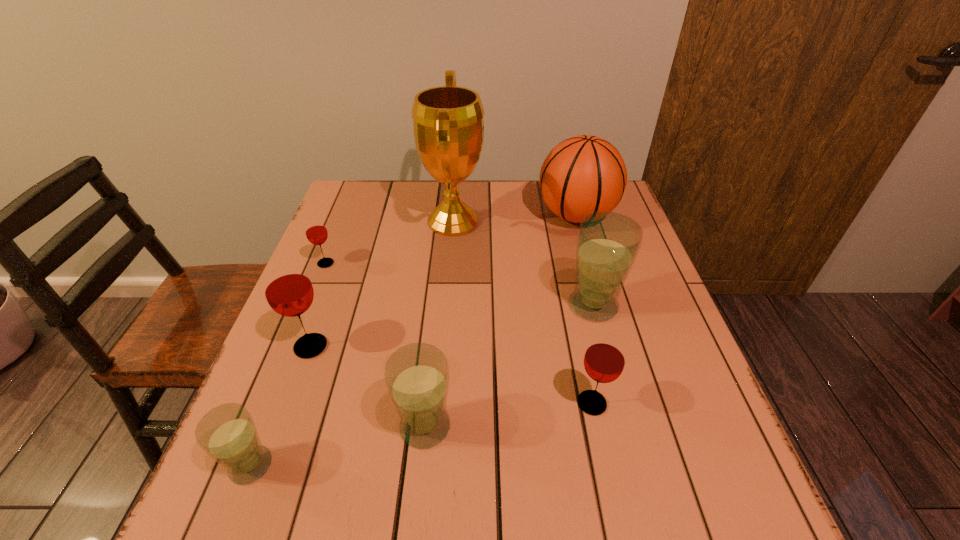
Locate an element on the screen. The width and height of the screenshot is (960, 540). gold award is located at coordinates (448, 124).

At what (x,y) coordinates should I click in order to perform the action: click on award. Please return your answer as a coordinate pair (x, y). Looking at the image, I should click on (448, 124).

Locate an element on the screen. basketball is located at coordinates (584, 174).

I want to click on the fifth nearest glass, so click(x=608, y=243).

Find the location of `the biggest blue glass`. the biggest blue glass is located at coordinates (608, 243).

The width and height of the screenshot is (960, 540). What are the coordinates of `the fifth farthest object` in the screenshot? It's located at (288, 290).

At what (x,y) coordinates should I click in order to perform the action: click on the fourth nearest glass. Please return your answer as a coordinate pair (x, y). Looking at the image, I should click on (288, 290).

At what (x,y) coordinates should I click in order to perform the action: click on the nearest red glass. Please return your answer as a coordinate pair (x, y). Looking at the image, I should click on (604, 360).

This screenshot has width=960, height=540. In order to click on the rightmost red glass in this screenshot , I will do `click(604, 360)`.

Locate an element on the screen. This screenshot has width=960, height=540. the fourth glass from left to right is located at coordinates (417, 377).